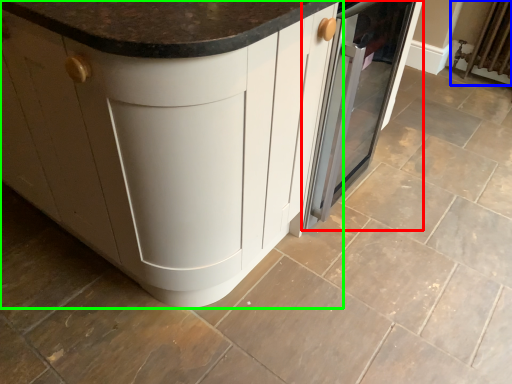
Question: Estimate the real-world distances between objects in this image. Which object is closer to home appliance (highlighted by a red box), radiator (highlighted by a blue box) or cabinetry (highlighted by a green box)?

Choices:
 (A) radiator
 (B) cabinetry

Answer: (B)